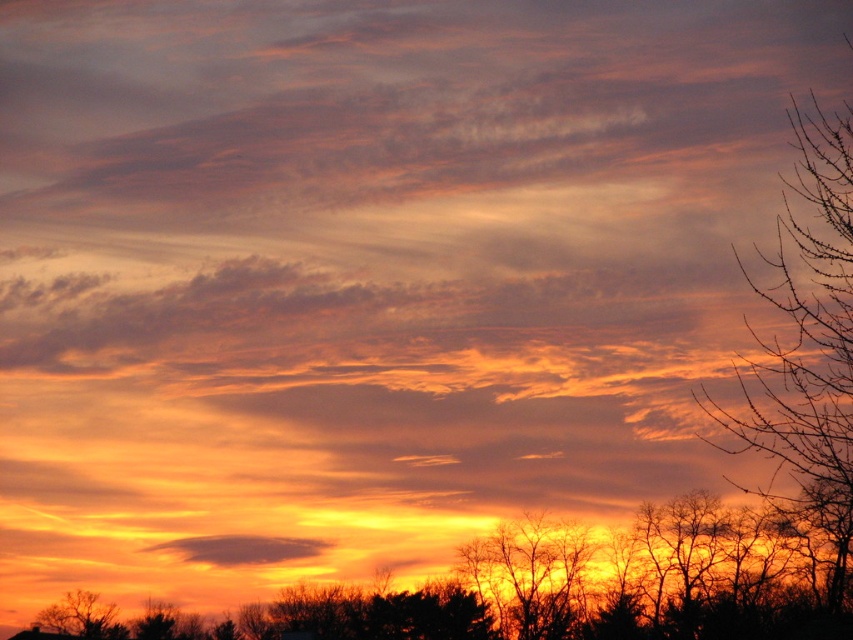
Is bare branches at right thinner than translucent orange cloud at center?

No.

Who is more distant from viewer, (843, 170) or (186, 538)?

The point (186, 538) is more distant.

Locate an element on the screen. The height and width of the screenshot is (640, 853). bare branches at right is located at coordinates (805, 349).

Between point (631, 596) and point (280, 540), which one is positioned behind?

Point (631, 596)

Can you confirm if silhouette bare tree at bottom is taller than translucent orange cloud at center?

Correct, silhouette bare tree at bottom is much taller as translucent orange cloud at center.

Image resolution: width=853 pixels, height=640 pixels. I want to click on silhouette bare tree at bottom, so click(589, 584).

Measure the distance from bare branches at right to silhouette bare tree at lower left.

bare branches at right is 32.60 meters from silhouette bare tree at lower left.

Can you confirm if bare branches at right is bigger than silhouette bare tree at lower left?

Indeed, bare branches at right has a larger size compared to silhouette bare tree at lower left.

Is point (804, 200) positioned before point (93, 634)?

That is True.

This screenshot has width=853, height=640. In order to click on bare branches at right in this screenshot , I will do `click(805, 349)`.